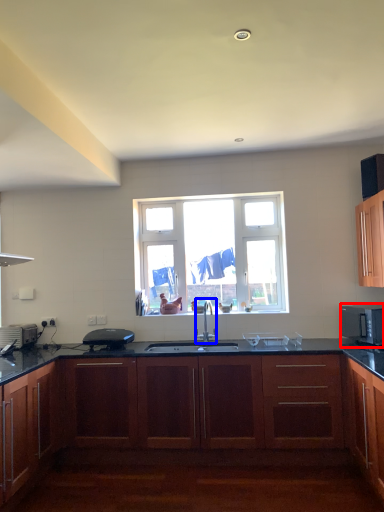
Question: Which of the following is the closest to the observer, microwave oven (highlighted by a red box) or tap (highlighted by a blue box)?

Choices:
 (A) microwave oven
 (B) tap

Answer: (A)